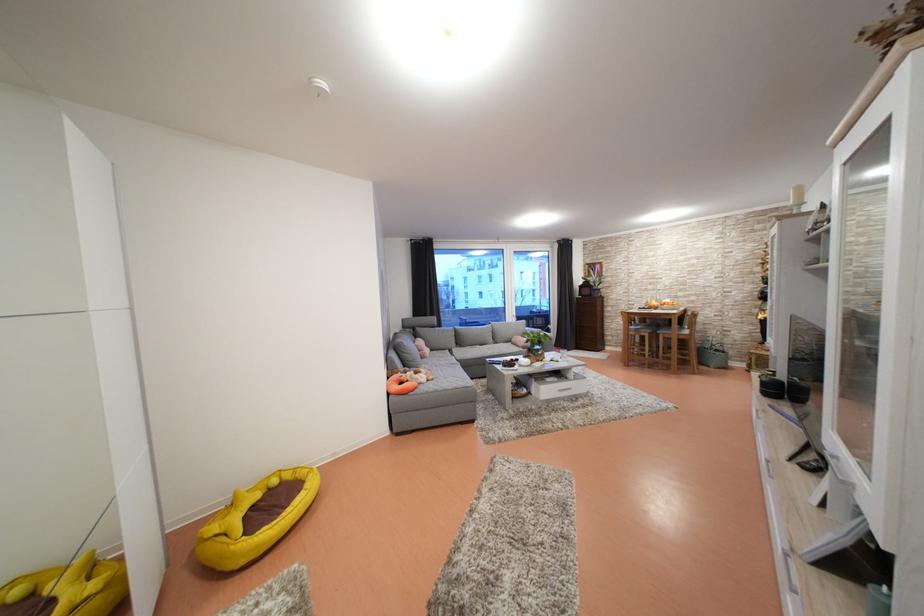
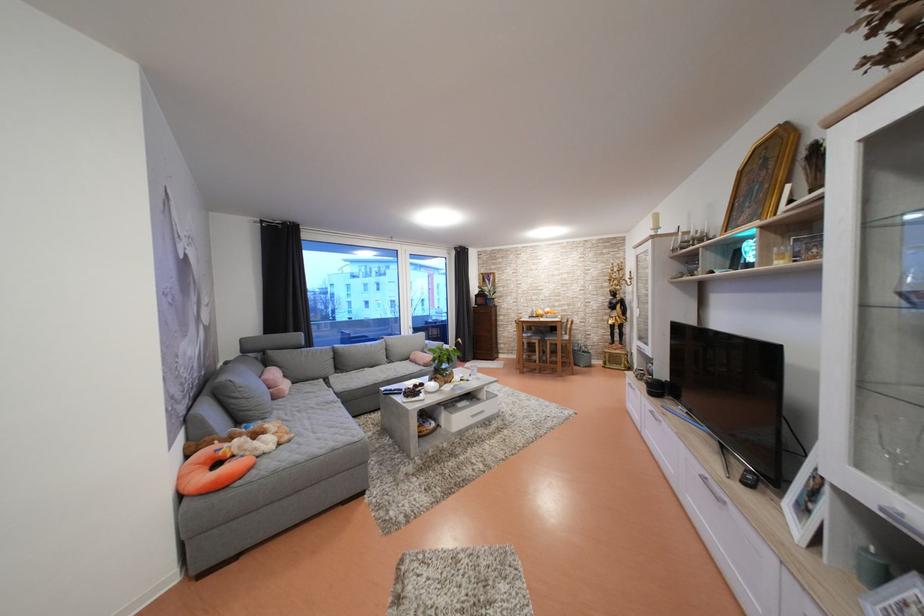
The point at [531,353] is marked in the first image. Where is the corresponding point in the second image?

(432, 370)